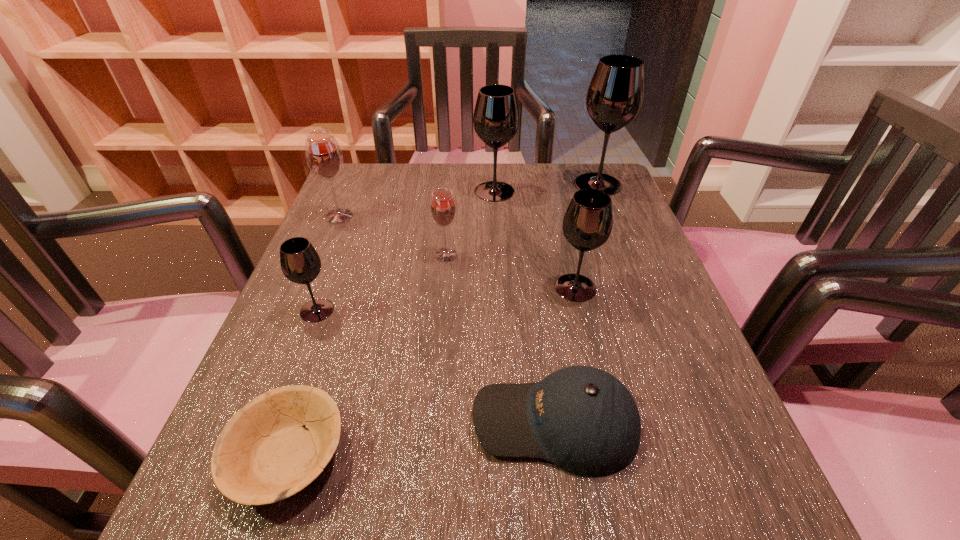
What are the coordinates of `the leftmost gray wineglass` in the screenshot? It's located at (300, 262).

At what (x,y) coordinates should I click in order to perform the action: click on baseball cap. Please return your answer as a coordinate pair (x, y). The width and height of the screenshot is (960, 540). Looking at the image, I should click on (584, 420).

Identify the location of blue baseball cap. (584, 420).

Identify the location of the shortest object. The height and width of the screenshot is (540, 960). (263, 455).

I want to click on free spot located 0.390m on the front of the biggest gray wineglass, so click(645, 308).

Where is `free spot located 0.250m on the front of the third wineglass from right to left`? free spot located 0.250m on the front of the third wineglass from right to left is located at coordinates [x=498, y=268].

Where is `vacant area located 0.050m on the back of the farther red wineglass`? This screenshot has width=960, height=540. vacant area located 0.050m on the back of the farther red wineglass is located at coordinates (348, 197).

At what (x,y) coordinates should I click in order to perform the action: click on vacant point located 0.060m on the left of the second smallest gray wineglass. Please return your answer as a coordinate pair (x, y). This screenshot has height=540, width=960. Looking at the image, I should click on (523, 287).

You are a GUI agent. You are given a task and a screenshot of the screen. Output one action in this format:
    pyautogui.click(x=<x>, y=<y>)
    Task: Click on the vacant space located on the front of the nearer red wineglass
    The width and height of the screenshot is (960, 540).
    Given the screenshot: What is the action you would take?
    pyautogui.click(x=438, y=351)

You are a GUI agent. You are given a task and a screenshot of the screen. Output one action in this format:
    pyautogui.click(x=<x>, y=<y>)
    Task: Click on the free space located on the right of the leftmost gray wineglass
    The image size is (960, 540).
    Given the screenshot: What is the action you would take?
    pyautogui.click(x=511, y=310)